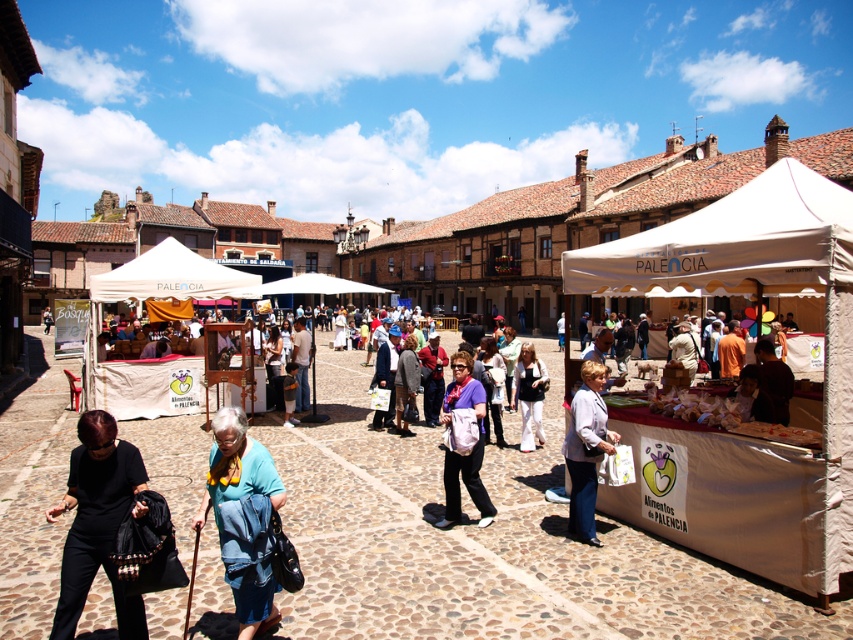
You are a tourist standing in the plaza and see the white fabric canopy at right and the light blue fabric jacket at lower right. Which object is higher from the ground?

The white fabric canopy at right is above the light blue fabric jacket at lower right, so the white fabric canopy at right is higher from the ground.